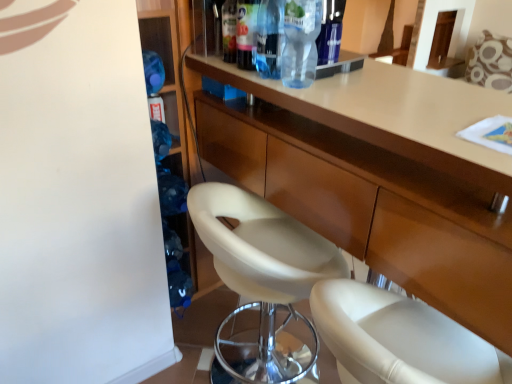
Identify the location of white leather chair at center. This screenshot has width=512, height=384. coord(262,284).

The image size is (512, 384). I want to click on transparent plastic bottle at upper center, positioned as the 2th bottle in right-to-left order, so click(x=300, y=40).

Considering the relative sizes of translucent plastic bottle at upper center, the fourth bottle in the right-to-left sequence, and transparent plastic bottle at upper center, positioned as the 2th bottle in right-to-left order, in the image provided, is translucent plastic bottle at upper center, the fourth bottle in the right-to-left sequence, wider than transparent plastic bottle at upper center, positioned as the 2th bottle in right-to-left order,?

In fact, translucent plastic bottle at upper center, the fourth bottle in the right-to-left sequence, might be narrower than transparent plastic bottle at upper center, positioned as the 2th bottle in right-to-left order.

Between translucent plastic bottle at upper center, the fourth bottle in the right-to-left sequence, and transparent plastic bottle at upper center, the third bottle viewed from the left, which one has larger size?

Bigger between the two is transparent plastic bottle at upper center, the third bottle viewed from the left.

Based on the photo, is transparent plastic bottle at upper center, the third bottle viewed from the left, inside translucent plastic bottle at upper center, which ranks as the 1th bottle in left-to-right order?

No.

Which is farther, (272, 8) or (226, 325)?

The point (226, 325) is behind.

Based on the photo, how many degrees apart are the facing directions of transparent plastic bottle at upper center, which is counted as the third bottle, starting from the right, and white leather chair at center?

83.8 degrees.

Where is `chair that appears below the transparent plastic bottle at upper center, which is counted as the third bottle, starting from the right (from the image's perspective)`? chair that appears below the transparent plastic bottle at upper center, which is counted as the third bottle, starting from the right (from the image's perspective) is located at coordinates (262, 284).

Is transparent plastic bottle at upper center, which is counted as the third bottle, starting from the right, positioned before white leather chair at center?

No, transparent plastic bottle at upper center, which is counted as the third bottle, starting from the right, is behind white leather chair at center.

Between point (280, 277) and point (389, 172), which one is positioned behind?

The point (280, 277) is more distant.

Could you tell me if white leather chair at center is facing matte wood cabinet at center?

Yes, white leather chair at center faces towards matte wood cabinet at center.

From a real-world perspective, is white leather chair at center over matte wood cabinet at center?

No, from a real-world perspective, white leather chair at center is not over matte wood cabinet at center

Who is shorter, transparent plastic bottle at upper center, positioned as the 2th bottle in right-to-left order, or transparent plastic bottle at upper center, the first bottle in the right-to-left sequence?

transparent plastic bottle at upper center, positioned as the 2th bottle in right-to-left order, is shorter.

Which is behind, transparent plastic bottle at upper center, positioned as the 2th bottle in right-to-left order, or transparent plastic bottle at upper center, the first bottle in the right-to-left sequence?

transparent plastic bottle at upper center, positioned as the 2th bottle in right-to-left order, is behind.

Is transparent plastic bottle at upper center, positioned as the 2th bottle in right-to-left order, at the left side of transparent plastic bottle at upper center, the first bottle in the right-to-left sequence?

Indeed, transparent plastic bottle at upper center, positioned as the 2th bottle in right-to-left order, is positioned on the left side of transparent plastic bottle at upper center, the first bottle in the right-to-left sequence.

Is the surface of transparent plastic bottle at upper center, the third bottle viewed from the left, in direct contact with transparent plastic bottle at upper center, the 4th bottle from the left?

Yes, transparent plastic bottle at upper center, the third bottle viewed from the left, and transparent plastic bottle at upper center, the 4th bottle from the left, clearly make contact.

Is translucent plastic bottle at upper center, which ranks as the 1th bottle in left-to-right order, not close to transparent plastic bottle at upper center, which is counted as the third bottle, starting from the right?

Actually, translucent plastic bottle at upper center, which ranks as the 1th bottle in left-to-right order, and transparent plastic bottle at upper center, which is counted as the third bottle, starting from the right, are a little close together.

From their relative heights in the image, would you say translucent plastic bottle at upper center, the fourth bottle in the right-to-left sequence, is taller or shorter than transparent plastic bottle at upper center, which is counted as the third bottle, starting from the right?

Clearly, translucent plastic bottle at upper center, the fourth bottle in the right-to-left sequence, is shorter compared to transparent plastic bottle at upper center, which is counted as the third bottle, starting from the right.

Is translucent plastic bottle at upper center, which ranks as the 1th bottle in left-to-right order, bigger or smaller than transparent plastic bottle at upper center, which ranks as the 2th bottle in left-to-right order?

Clearly, translucent plastic bottle at upper center, which ranks as the 1th bottle in left-to-right order, is larger in size than transparent plastic bottle at upper center, which ranks as the 2th bottle in left-to-right order.

You are a GUI agent. You are given a task and a screenshot of the screen. Output one action in this format:
    pyautogui.click(x=<x>, y=<y>)
    Task: Click on the 2nd bottle positioned below the translucent plastic bottle at upper center, which ranks as the 1th bottle in left-to-right order (from the image's perspective)
    The width and height of the screenshot is (512, 384).
    Given the screenshot: What is the action you would take?
    pyautogui.click(x=269, y=38)

Considering the points (241, 12) and (409, 127), which point is behind, point (241, 12) or point (409, 127)?

The point (241, 12) is behind.

Who is more distant, translucent plastic bottle at upper center, the fourth bottle in the right-to-left sequence, or matte wood cabinet at center?

translucent plastic bottle at upper center, the fourth bottle in the right-to-left sequence, is further away from the camera.

Consider the image. Is translucent plastic bottle at upper center, which ranks as the 1th bottle in left-to-right order, wider than matte wood cabinet at center?

Incorrect, the width of translucent plastic bottle at upper center, which ranks as the 1th bottle in left-to-right order, does not surpass that of matte wood cabinet at center.

From the matte wood cabinet at center, count the 4th bottle to the left and point to it. Please provide its 2D coordinates.

[(246, 33)]

Which of these two, matte wood cabinet at center or transparent plastic bottle at upper center, positioned as the 2th bottle in right-to-left order, is thinner?

transparent plastic bottle at upper center, positioned as the 2th bottle in right-to-left order, is thinner.

Can you tell me how much matte wood cabinet at center and transparent plastic bottle at upper center, positioned as the 2th bottle in right-to-left order, differ in facing direction?

88.2 degrees separate the facing orientations of matte wood cabinet at center and transparent plastic bottle at upper center, positioned as the 2th bottle in right-to-left order.

Is transparent plastic bottle at upper center, the third bottle viewed from the left, inside matte wood cabinet at center?

No.

From a real-world perspective, who is located higher, matte wood cabinet at center or transparent plastic bottle at upper center, the third bottle viewed from the left?

transparent plastic bottle at upper center, the third bottle viewed from the left.

From a real-world perspective, count 2nd bottles upward from the transparent plastic bottle at upper center, positioned as the 2th bottle in right-to-left order, and point to it. Please provide its 2D coordinates.

[(246, 33)]

Locate an element on the screen. Image resolution: width=512 pixels, height=384 pixels. bottle that is the 1st object to the right of the white leather chair at center, starting at the anchor is located at coordinates (269, 38).

Looking at the image, which one is located closer to transparent plastic bottle at upper center, which is counted as the third bottle, starting from the right, transparent plastic bottle at upper center, the 4th bottle from the left, or white leather chair at center?

transparent plastic bottle at upper center, the 4th bottle from the left, is positioned closer to the anchor transparent plastic bottle at upper center, which is counted as the third bottle, starting from the right.

Which object lies nearer to the anchor point transparent plastic bottle at upper center, the first bottle in the right-to-left sequence, transparent plastic bottle at upper center, which is counted as the third bottle, starting from the right, or matte wood cabinet at center?

The object closer to transparent plastic bottle at upper center, the first bottle in the right-to-left sequence, is transparent plastic bottle at upper center, which is counted as the third bottle, starting from the right.

Which object lies further to the anchor point translucent plastic bottle at upper center, the fourth bottle in the right-to-left sequence, transparent plastic bottle at upper center, the third bottle viewed from the left, or transparent plastic bottle at upper center, the 4th bottle from the left?

transparent plastic bottle at upper center, the 4th bottle from the left.

Based on their spatial positions, is transparent plastic bottle at upper center, the first bottle in the right-to-left sequence, or white leather chair at center closer to translucent plastic bottle at upper center, which ranks as the 1th bottle in left-to-right order?

Among the two, transparent plastic bottle at upper center, the first bottle in the right-to-left sequence, is located nearer to translucent plastic bottle at upper center, which ranks as the 1th bottle in left-to-right order.

Estimate the real-world distances between objects in this image. Which object is closer to white leather chair at center, matte wood cabinet at center or transparent plastic bottle at upper center, the 4th bottle from the left?

matte wood cabinet at center is closer to white leather chair at center.

Looking at this image, considering their positions, is transparent plastic bottle at upper center, positioned as the 2th bottle in right-to-left order, positioned closer to transparent plastic bottle at upper center, which is counted as the third bottle, starting from the right, than matte wood cabinet at center?

transparent plastic bottle at upper center, positioned as the 2th bottle in right-to-left order, is closer to transparent plastic bottle at upper center, which is counted as the third bottle, starting from the right.

Based on the photo, looking at the image, which one is located closer to translucent plastic bottle at upper center, which ranks as the 1th bottle in left-to-right order, transparent plastic bottle at upper center, which ranks as the 2th bottle in left-to-right order, or matte wood cabinet at center?

transparent plastic bottle at upper center, which ranks as the 2th bottle in left-to-right order, is positioned closer to the anchor translucent plastic bottle at upper center, which ranks as the 1th bottle in left-to-right order.

In the scene shown: Based on their spatial positions, is translucent plastic bottle at upper center, the fourth bottle in the right-to-left sequence, or matte wood cabinet at center further from transparent plastic bottle at upper center, which is counted as the third bottle, starting from the right?

Among the two, matte wood cabinet at center is located further to transparent plastic bottle at upper center, which is counted as the third bottle, starting from the right.

The height and width of the screenshot is (384, 512). Identify the location of cabinetry between translucent plastic bottle at upper center, which ranks as the 1th bottle in left-to-right order, and white leather chair at center in the up-down direction. (379, 176).

This screenshot has height=384, width=512. I want to click on bottle between transparent plastic bottle at upper center, which ranks as the 2th bottle in left-to-right order, and matte wood cabinet at center from top to bottom, so click(x=300, y=42).

Find the location of a particular element. This screenshot has height=384, width=512. bottle between transparent plastic bottle at upper center, which is counted as the third bottle, starting from the right, and transparent plastic bottle at upper center, the 4th bottle from the left is located at coordinates (300, 40).

The image size is (512, 384). I want to click on bottle between transparent plastic bottle at upper center, which ranks as the 2th bottle in left-to-right order, and white leather chair at center vertically, so click(x=300, y=42).